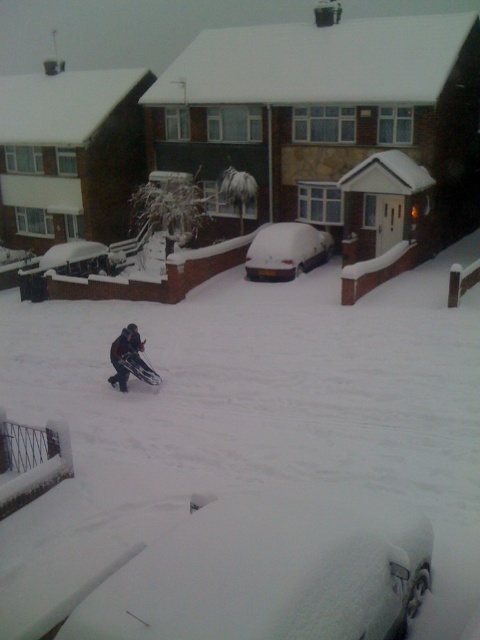
Measure the distance between snow-covered car at lower center and camera.

They are 3.93 meters apart.

Where is `snow-covered car at lower center`? snow-covered car at lower center is located at coordinates (237, 573).

Where is `snow-covered car at lower center`? snow-covered car at lower center is located at coordinates (237, 573).

Can you confirm if snow-covered car at center is smaller than metallic silver snowmobile at center?

No.

What do you see at coordinates (286, 252) in the screenshot? I see `snow-covered car at center` at bounding box center [286, 252].

Identify the location of snow-covered car at center. Image resolution: width=480 pixels, height=640 pixels. (286, 252).

Can you confirm if snow-covered car at lower center is shorter than metallic silver snowmobile at center?

Incorrect, snow-covered car at lower center's height does not fall short of metallic silver snowmobile at center's.

Can you confirm if snow-covered car at lower center is thinner than metallic silver snowmobile at center?

No, snow-covered car at lower center is not thinner than metallic silver snowmobile at center.

Which is behind, point (88, 541) or point (129, 353)?

Positioned behind is point (129, 353).

This screenshot has height=640, width=480. I want to click on snow-covered car at lower center, so click(237, 573).